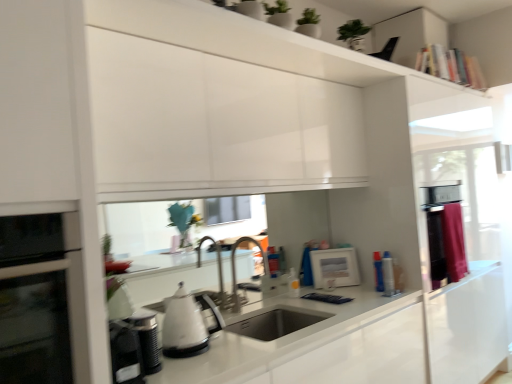
Question: Considering the relative sizes of white glossy kettle at lower left, which appears as the fourth appliance when viewed from the right, and maroon fabric curtain at right in the image provided, is white glossy kettle at lower left, which appears as the fourth appliance when viewed from the right, bigger than maroon fabric curtain at right?

Choices:
 (A) yes
 (B) no

Answer: (B)

Question: Does white glossy kettle at lower left, the first appliance in the front-to-back sequence, appear on the left side of maroon fabric curtain at right?

Choices:
 (A) yes
 (B) no

Answer: (A)

Question: Considering the relative sizes of white glossy kettle at lower left, which appears as the 4th appliance when viewed from the back, and maroon fabric curtain at right in the image provided, is white glossy kettle at lower left, which appears as the 4th appliance when viewed from the back, shorter than maroon fabric curtain at right?

Choices:
 (A) no
 (B) yes

Answer: (B)

Question: Does white glossy kettle at lower left, the 1th appliance positioned from the left, turn towards maroon fabric curtain at right?

Choices:
 (A) no
 (B) yes

Answer: (A)

Question: Is white glossy kettle at lower left, the first appliance in the front-to-back sequence, directly adjacent to maroon fabric curtain at right?

Choices:
 (A) yes
 (B) no

Answer: (B)

Question: From their relative heights in the image, would you say white glossy kettle at center is taller or shorter than white glossy kettle at lower center, which appears as the third appliance when viewed from the back?

Choices:
 (A) tall
 (B) short

Answer: (A)

Question: Based on their positions, is white glossy kettle at center located to the left or right of white glossy kettle at lower center, acting as the second appliance starting from the left?

Choices:
 (A) left
 (B) right

Answer: (B)

Question: From a real-world perspective, is white glossy kettle at center physically located above or below white glossy kettle at lower center, which appears as the third appliance when viewed from the back?

Choices:
 (A) above
 (B) below

Answer: (A)

Question: In the image, is white glossy kettle at center positioned in front of or behind white glossy kettle at lower center, which appears as the 3th appliance when viewed from the right?

Choices:
 (A) behind
 (B) front

Answer: (A)

Question: From a real-world perspective, is white glossy kettle at lower center, which appears as the third appliance when viewed from the back, above or below white glossy kettle at lower left, which appears as the 4th appliance when viewed from the back?

Choices:
 (A) above
 (B) below

Answer: (B)

Question: Considering the positions of white glossy kettle at lower center, which appears as the 3th appliance when viewed from the right, and white glossy kettle at lower left, which appears as the 4th appliance when viewed from the back, in the image, is white glossy kettle at lower center, which appears as the 3th appliance when viewed from the right, wider or thinner than white glossy kettle at lower left, which appears as the 4th appliance when viewed from the back,?

Choices:
 (A) wide
 (B) thin

Answer: (B)

Question: Is white glossy kettle at lower center, which appears as the 3th appliance when viewed from the right, bigger or smaller than white glossy kettle at lower left, which appears as the 4th appliance when viewed from the back?

Choices:
 (A) small
 (B) big

Answer: (A)

Question: Considering the positions of white glossy kettle at lower center, arranged as the second appliance when viewed from the front, and white glossy kettle at lower left, the first appliance in the front-to-back sequence, in the image, is white glossy kettle at lower center, arranged as the second appliance when viewed from the front, taller or shorter than white glossy kettle at lower left, the first appliance in the front-to-back sequence,?

Choices:
 (A) tall
 (B) short

Answer: (A)

Question: Considering the positions of white glossy picture frame at center, placed as the 3th appliance when sorted from left to right, and black glass oven at left in the image, is white glossy picture frame at center, placed as the 3th appliance when sorted from left to right, taller or shorter than black glass oven at left?

Choices:
 (A) tall
 (B) short

Answer: (B)

Question: Considering the positions of white glossy picture frame at center, which ranks as the 1th appliance in back-to-front order, and black glass oven at left in the image, is white glossy picture frame at center, which ranks as the 1th appliance in back-to-front order, bigger or smaller than black glass oven at left?

Choices:
 (A) big
 (B) small

Answer: (B)